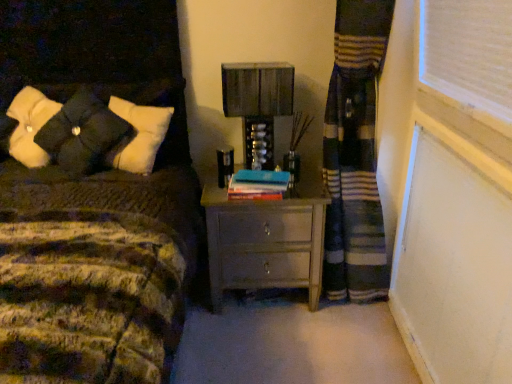
The width and height of the screenshot is (512, 384). I want to click on metallic silver table lamp at center, so click(x=260, y=107).

The height and width of the screenshot is (384, 512). What do you see at coordinates (96, 56) in the screenshot?
I see `velvety black pillows at upper left` at bounding box center [96, 56].

What is the approximate height of blue matte book at center?

The height of blue matte book at center is 3.20 inches.

The image size is (512, 384). Identify the location of matte gray nightstand at center. (266, 241).

Identify the location of metallic silver table lamp at center. (260, 107).

Is blue matte book at center beside matte gray nightstand at center?

No, blue matte book at center is not making contact with matte gray nightstand at center.

Can you confirm if blue matte book at center is positioned to the right of matte gray nightstand at center?

Incorrect, blue matte book at center is not on the right side of matte gray nightstand at center.

Can you confirm if blue matte book at center is wider than matte gray nightstand at center?

In fact, blue matte book at center might be narrower than matte gray nightstand at center.

Is the depth of metallic silver table lamp at center less than that of matte gray nightstand at center?

No, the depth of metallic silver table lamp at center is greater than that of matte gray nightstand at center.

From a real-world perspective, relative to matte gray nightstand at center, is metallic silver table lamp at center vertically above or below?

From a real-world perspective, metallic silver table lamp at center is physically above matte gray nightstand at center.

From the image's perspective, is metallic silver table lamp at center on top of matte gray nightstand at center?

Yes, from the image's perspective, metallic silver table lamp at center is over matte gray nightstand at center.

In the scene shown: Is metallic silver table lamp at center turned away from matte gray nightstand at center?

No, metallic silver table lamp at center is not facing the opposite direction of matte gray nightstand at center.

Looking at the image, does matte gray nightstand at center seem bigger or smaller compared to blue matte book at center?

Clearly, matte gray nightstand at center is larger in size than blue matte book at center.

In the image, is matte gray nightstand at center positioned in front of or behind blue matte book at center?

matte gray nightstand at center is behind blue matte book at center.

Which object is wider, matte gray nightstand at center or blue matte book at center?

Wider between the two is matte gray nightstand at center.

From a real-world perspective, relative to blue matte book at center, is matte gray nightstand at center vertically above or below?

matte gray nightstand at center is below blue matte book at center.

Which of these two, velvety black pillows at upper left or matte gray nightstand at center, is thinner?

velvety black pillows at upper left.

Considering their positions, is velvety black pillows at upper left located in front of or behind matte gray nightstand at center?

Visually, velvety black pillows at upper left is located in front of matte gray nightstand at center.

Could you tell me if velvety black pillows at upper left is turned towards matte gray nightstand at center?

No, velvety black pillows at upper left is not turned towards matte gray nightstand at center.

Could you tell me if metallic silver table lamp at center is turned towards blue matte book at center?

Yes.

Do you think metallic silver table lamp at center is within blue matte book at center, or outside of it?

The correct answer is: outside.

I want to click on book that is in front of the metallic silver table lamp at center, so click(x=258, y=184).

Locate an element on the screen. The image size is (512, 384). table lamp located above the matte gray nightstand at center (from the image's perspective) is located at coordinates (260, 107).

Measure the distance between matte gray nightstand at center and metallic silver table lamp at center.

matte gray nightstand at center is 41.61 centimeters away from metallic silver table lamp at center.

From the image's perspective, between matte gray nightstand at center and metallic silver table lamp at center, which one is located above?

metallic silver table lamp at center appears higher in the image.

Between matte gray nightstand at center and metallic silver table lamp at center, which one is positioned in front?

matte gray nightstand at center is more forward.

From a real-world perspective, relative to velvety black pillows at upper left, is metallic silver table lamp at center vertically above or below?

In terms of real-world spatial position, metallic silver table lamp at center is below velvety black pillows at upper left.

Can you confirm if metallic silver table lamp at center is taller than velvety black pillows at upper left?

No.

Would you say metallic silver table lamp at center is inside or outside velvety black pillows at upper left?

metallic silver table lamp at center lies outside velvety black pillows at upper left.

You are a GUI agent. You are given a task and a screenshot of the screen. Output one action in this format:
    pyautogui.click(x=<x>, y=<y>)
    Task: Click on the book on the left of matte gray nightstand at center
    This screenshot has height=384, width=512.
    Given the screenshot: What is the action you would take?
    pyautogui.click(x=258, y=184)

Locate an element on the screen. table lamp that is above the matte gray nightstand at center (from a real-world perspective) is located at coordinates [260, 107].

Considering their positions, is matte gray nightstand at center positioned closer to velvety black pillows at upper left than blue matte book at center?

blue matte book at center is closer to velvety black pillows at upper left.

When comparing their distances from metallic silver table lamp at center, does matte gray nightstand at center or velvety black pillows at upper left seem closer?

matte gray nightstand at center lies closer to metallic silver table lamp at center than the other object.

When comparing their distances from blue matte book at center, does matte gray nightstand at center or metallic silver table lamp at center seem closer?

metallic silver table lamp at center is closer to blue matte book at center.

From the image, which object appears to be nearer to matte gray nightstand at center, blue matte book at center or velvety black pillows at upper left?

blue matte book at center is closer to matte gray nightstand at center.

Considering their positions, is metallic silver table lamp at center positioned further to velvety black pillows at upper left than matte gray nightstand at center?

Among the two, matte gray nightstand at center is located further to velvety black pillows at upper left.

When comparing their distances from blue matte book at center, does matte gray nightstand at center or velvety black pillows at upper left seem closer?

The object closer to blue matte book at center is matte gray nightstand at center.

Considering their positions, is velvety black pillows at upper left positioned closer to metallic silver table lamp at center than matte gray nightstand at center?

Based on the image, matte gray nightstand at center appears to be nearer to metallic silver table lamp at center.

From the image, which object appears to be farther from matte gray nightstand at center, blue matte book at center or metallic silver table lamp at center?

Among the two, metallic silver table lamp at center is located further to matte gray nightstand at center.

Find the location of a particular element. Image resolution: width=512 pixels, height=384 pixels. table lamp located between velvety black pillows at upper left and matte gray nightstand at center in the left-right direction is located at coordinates (260, 107).

Locate an element on the screen. book between velvety black pillows at upper left and matte gray nightstand at center from left to right is located at coordinates (258, 184).

What are the coordinates of `book between metallic silver table lamp at center and matte gray nightstand at center vertically` in the screenshot? It's located at pyautogui.click(x=258, y=184).

Where is `table lamp between velvety black pillows at upper left and blue matte book at center`? table lamp between velvety black pillows at upper left and blue matte book at center is located at coordinates (260, 107).